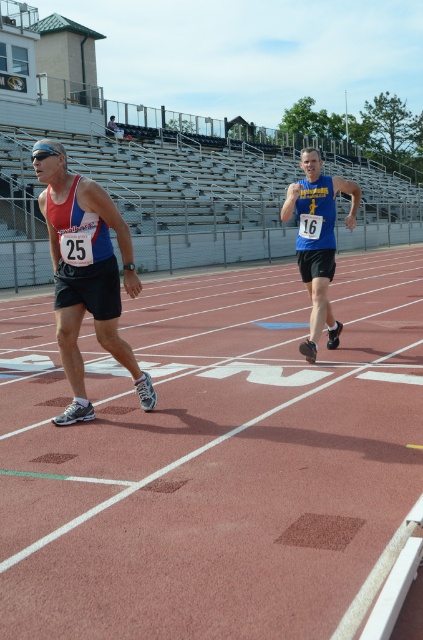
You are a photographer positioned at the starting line of the track race. You need to take a photo that includes both the matte blue tank top at left and the blue jersey at center. Based on their positions, which direction should you pan your camera to include both in the frame?

Since the matte blue tank top at left is to the left of the blue jersey at center, you should pan your camera to the left to include both the matte blue tank top at left and the blue jersey at center in the frame.

In the scene shown: What is the 2D coordinate of the rubberized track at center?

The 2D coordinate of the rubberized track at center is at point (213, 460).